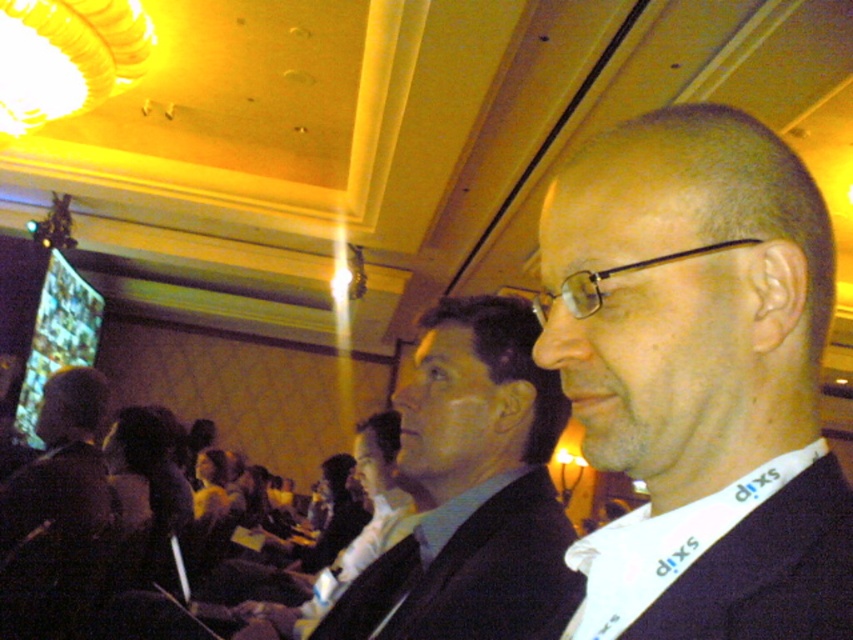
Question: Where is dark blue suit at center located in relation to dark brown leather jacket at left in the image?

Choices:
 (A) right
 (B) left

Answer: (A)

Question: Is dark suit at center closer to the viewer compared to dark brown leather jacket at left?

Choices:
 (A) no
 (B) yes

Answer: (B)

Question: Which object appears farthest from the camera in this image?

Choices:
 (A) dark blue suit at center
 (B) dark brown leather jacket at left

Answer: (B)

Question: Can you confirm if dark suit at center is smaller than dark brown leather jacket at left?

Choices:
 (A) no
 (B) yes

Answer: (B)

Question: Which point is closer to the camera?

Choices:
 (A) 549,442
 (B) 758,573

Answer: (B)

Question: Which is nearer to the dark blue suit at center?

Choices:
 (A) dark brown leather jacket at left
 (B) dark suit at center

Answer: (B)